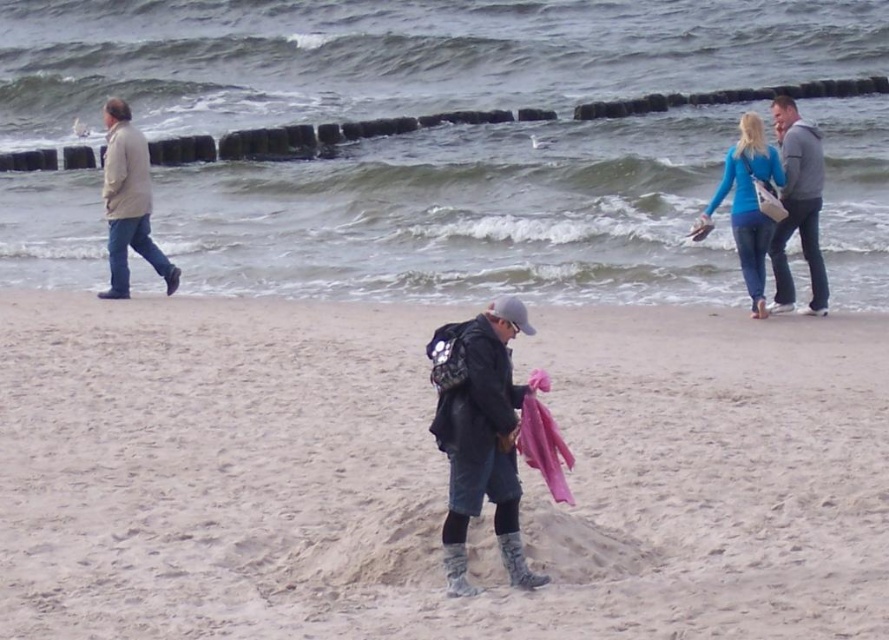
Question: Where is matte black jacket at center located in relation to gray sweater at upper right in the image?

Choices:
 (A) above
 (B) below

Answer: (B)

Question: Based on their relative distances, which object is farther from the gray sweater at upper right?

Choices:
 (A) blue matte jacket at upper right
 (B) matte black jacket at center
 (C) light brown leather jacket at left
 (D) smooth sand at center

Answer: (B)

Question: Is gray sweater at upper right closer to the viewer compared to blue matte jacket at upper right?

Choices:
 (A) yes
 (B) no

Answer: (B)

Question: Which object is farther from the camera taking this photo?

Choices:
 (A) light brown leather jacket at left
 (B) blue matte jacket at upper right
 (C) smooth sand at center

Answer: (A)

Question: Can you confirm if matte black jacket at center is positioned to the left of light brown leather jacket at left?

Choices:
 (A) no
 (B) yes

Answer: (A)

Question: Among these points, which one is nearest to the camera?

Choices:
 (A) tap(447, 429)
 (B) tap(172, 288)
 (C) tap(301, 324)

Answer: (A)